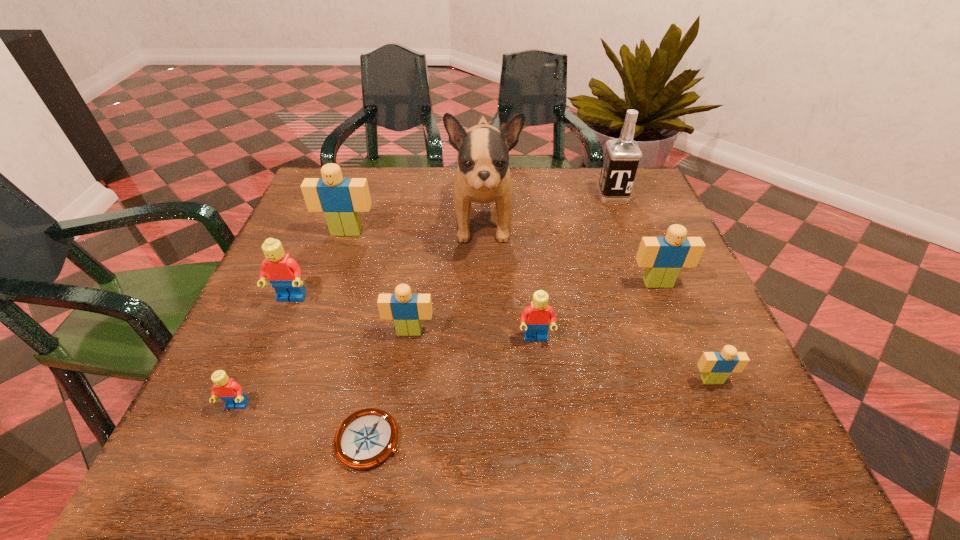
This screenshot has height=540, width=960. Identify the location of empty space between the fifth farthest object and the nearest beige Lego. (501, 340).

Identify the location of blank region between the biggest beige Lego and the second beige Lego from left to right. (378, 282).

At what (x,y) coordinates should I click in order to perform the action: click on free space between the shortest object and the biggest red Lego. Please return your answer as a coordinate pair (x, y). Looking at the image, I should click on (331, 369).

You are a GUI agent. You are given a task and a screenshot of the screen. Output one action in this format:
    pyautogui.click(x=<x>, y=<y>)
    Task: Click on the vacant region between the third farthest beige Lego and the shortest object
    
    Given the screenshot: What is the action you would take?
    pyautogui.click(x=391, y=386)

Where is `vacant space that is in between the shortest object and the second tallest object`? vacant space that is in between the shortest object and the second tallest object is located at coordinates (492, 318).

At what (x,y) coordinates should I click in order to perform the action: click on vacant area that lies between the biggest beige Lego and the second tallest object. Please return your answer as a coordinate pair (x, y). This screenshot has width=960, height=540. Looking at the image, I should click on (480, 214).

Where is `object identified as the ninth closest to the second tallest object`? The width and height of the screenshot is (960, 540). object identified as the ninth closest to the second tallest object is located at coordinates (227, 389).

Locate which object is the second closest to the third biggest beige Lego. Please provide its 2D coordinates. Your answer should be formatted as a tuple, i.e. [(x, y)], where the tuple contains the x and y coordinates of a point satisfying the conditions above.

[(536, 317)]

At what (x,y) coordinates should I click in order to perform the action: click on Lego that is the sixth closest to the tallest object. Please return your answer as a coordinate pair (x, y). Looking at the image, I should click on (715, 366).

Locate an element on the screen. The width and height of the screenshot is (960, 540). Lego that stands as the closest to the fourth farthest object is located at coordinates (715, 366).